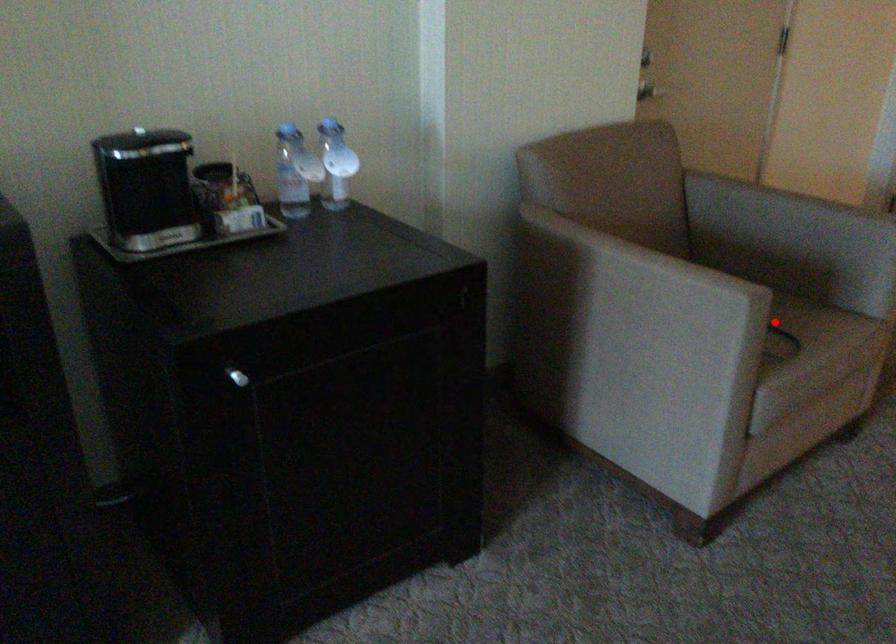
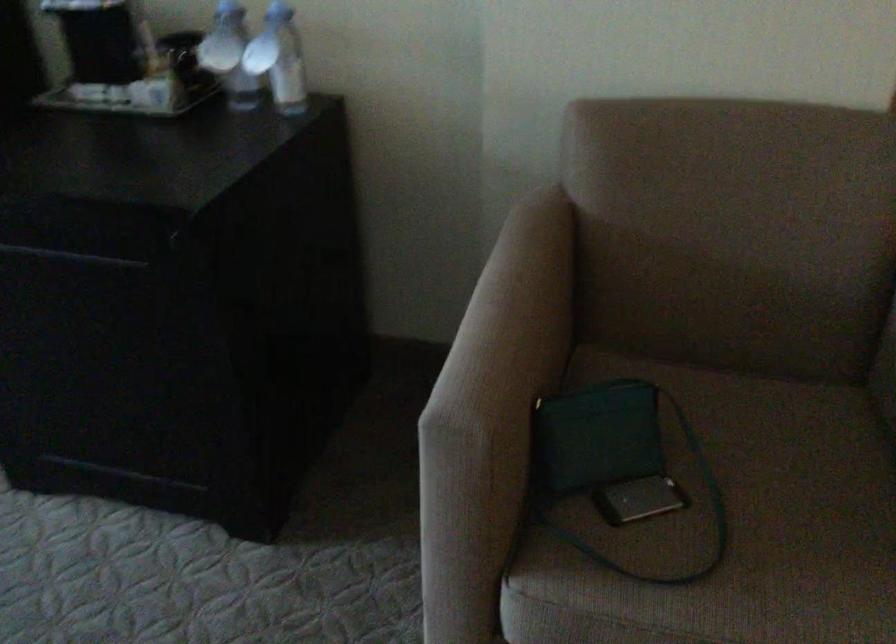
Question: I am providing you with two images of the same scene from different viewpoints. In image1, a red point is highlighted. Considering the same 3D point in image2, which of the following is correct?

Choices:
 (A) It is closer
 (B) It is farther

Answer: (A)